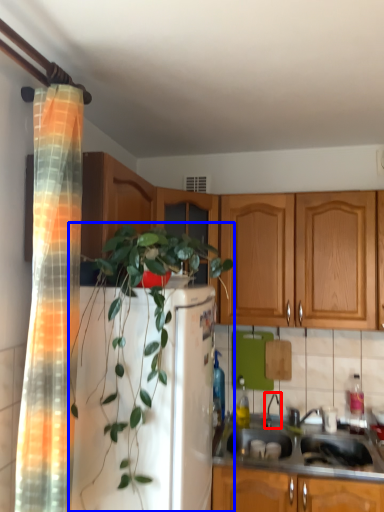
Question: Which object appears closest to the camera in this image, faucet (highlighted by a red box) or houseplant (highlighted by a blue box)?

Choices:
 (A) faucet
 (B) houseplant

Answer: (B)